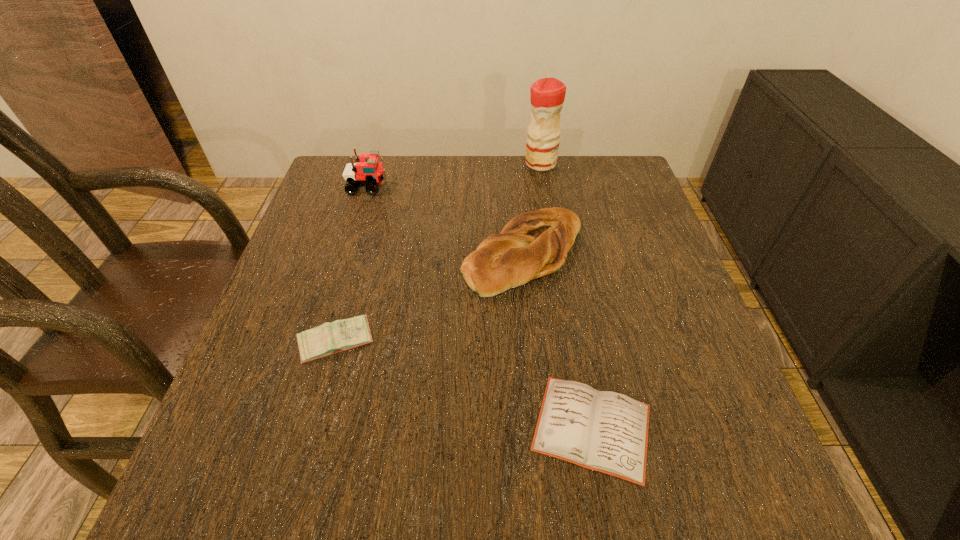
I want to click on empty space that is in between the farthest object and the shortest object, so click(566, 295).

I want to click on object identified as the third closest to the shortest object, so click(368, 172).

Identify which object is the second nearest to the left diary. Please provide its 2D coordinates. Your answer should be formatted as a tuple, i.e. [(x, y)], where the tuple contains the x and y coordinates of a point satisfying the conditions above.

[(604, 431)]

You are a GUI agent. You are given a task and a screenshot of the screen. Output one action in this format:
    pyautogui.click(x=<x>, y=<y>)
    Task: Click on the free space that satisfies the following two spatial constraints: 1. on the back side of the third shortest object; 2. on the front-facing side of the second tallest object
    The image size is (960, 540).
    Given the screenshot: What is the action you would take?
    pyautogui.click(x=517, y=186)

Locate an element on the screen. This screenshot has height=540, width=960. vacant area in the image that satisfies the following two spatial constraints: 1. on the front-facing side of the third nearest object; 2. on the left side of the second farthest object is located at coordinates (347, 254).

You are a GUI agent. You are given a task and a screenshot of the screen. Output one action in this format:
    pyautogui.click(x=<x>, y=<y>)
    Task: Click on the free space that satisfies the following two spatial constraints: 1. on the front-facing side of the fourth nearest object; 2. on the back side of the bread
    
    Given the screenshot: What is the action you would take?
    (x=347, y=254)

Where is `free spot that satisfies the following two spatial constraints: 1. on the back side of the farther diary; 2. on the front-facing side of the fourth nearest object`? This screenshot has height=540, width=960. free spot that satisfies the following two spatial constraints: 1. on the back side of the farther diary; 2. on the front-facing side of the fourth nearest object is located at coordinates (379, 186).

The width and height of the screenshot is (960, 540). I want to click on free space in the image that satisfies the following two spatial constraints: 1. on the back side of the taller diary; 2. on the right side of the third tallest object, so click(360, 254).

Image resolution: width=960 pixels, height=540 pixels. I want to click on free location that satisfies the following two spatial constraints: 1. on the back side of the second shortest object; 2. on the left side of the tallest object, so click(385, 164).

This screenshot has height=540, width=960. What are the coordinates of `free spot that satisfies the following two spatial constraints: 1. on the back side of the farther diary; 2. on the front-facing side of the second farthest object` in the screenshot? It's located at (379, 186).